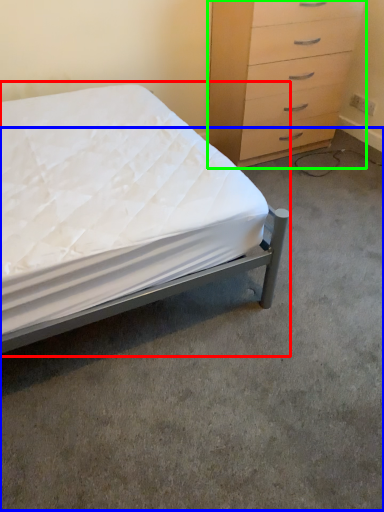
Question: Considering the real-world distances, which object is closest to bed (highlighted by a red box)? concrete (highlighted by a blue box) or chest of drawers (highlighted by a green box).

Choices:
 (A) concrete
 (B) chest of drawers

Answer: (A)